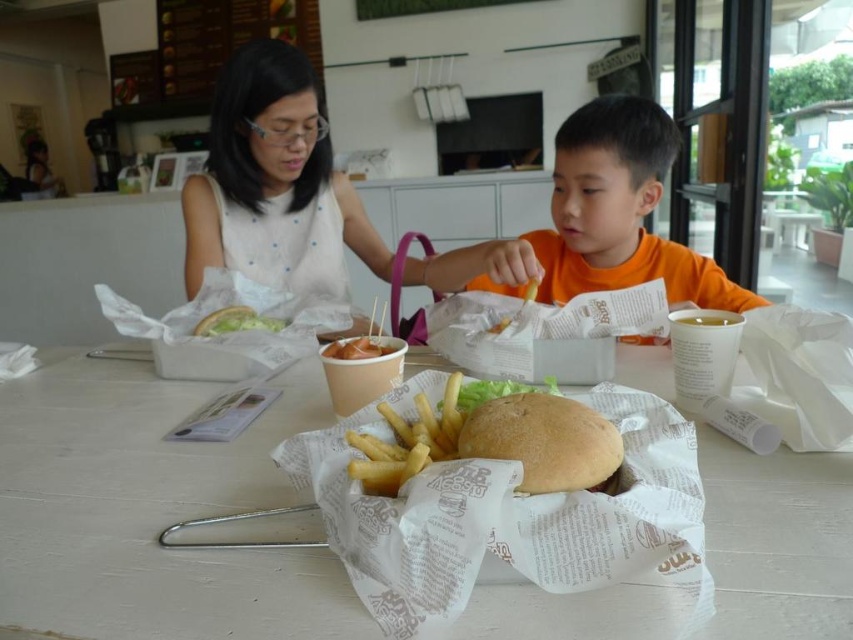
Question: Does bread-like bun at center appear on the left side of yellowish matte chicken at center?

Choices:
 (A) no
 (B) yes

Answer: (A)

Question: Does golden crispy fries at center have a greater width compared to yellowish matte chicken at center?

Choices:
 (A) no
 (B) yes

Answer: (B)

Question: Which of the following is the closest to the observer?

Choices:
 (A) (602, 470)
 (B) (460, 259)
 (C) (424, 438)
 (D) (161, 513)

Answer: (A)

Question: Which point is farther from the camera taking this photo?

Choices:
 (A) 78,413
 (B) 368,356
 (C) 360,228

Answer: (C)

Question: Is white matte shirt at upper left positioned behind bread-like bun at center?

Choices:
 (A) yes
 (B) no

Answer: (A)

Question: Which object is farther from the camera taking this photo?

Choices:
 (A) white matte shirt at upper left
 (B) bread-like bun at center
 (C) yellowish matte chicken at center

Answer: (A)